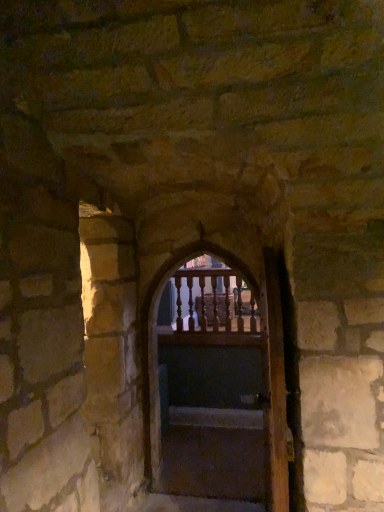
Question: Is smooth concrete stairs at center taller or shorter than wooden door at center, marked as the 1th door in a front-to-back arrangement?

Choices:
 (A) short
 (B) tall

Answer: (A)

Question: Is smooth concrete stairs at center in front of or behind wooden door at center, marked as the 1th door in a front-to-back arrangement, in the image?

Choices:
 (A) behind
 (B) front

Answer: (A)

Question: Considering the real-world distances, which object is closest to the wooden at center, acting as the second door starting from the front?

Choices:
 (A) wooden door at center, which is the second door from back to front
 (B) smooth concrete stairs at center

Answer: (B)

Question: Which object is the closest to the wooden at center, acting as the second door starting from the front?

Choices:
 (A) wooden door at center, which is the second door from back to front
 (B) smooth concrete stairs at center

Answer: (B)